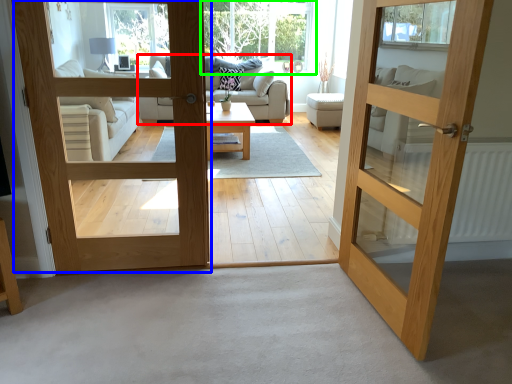
Question: Considering the real-world distances, which object is closest to studio couch (highlighted by a red box)? door (highlighted by a blue box) or window (highlighted by a green box).

Choices:
 (A) door
 (B) window

Answer: (B)